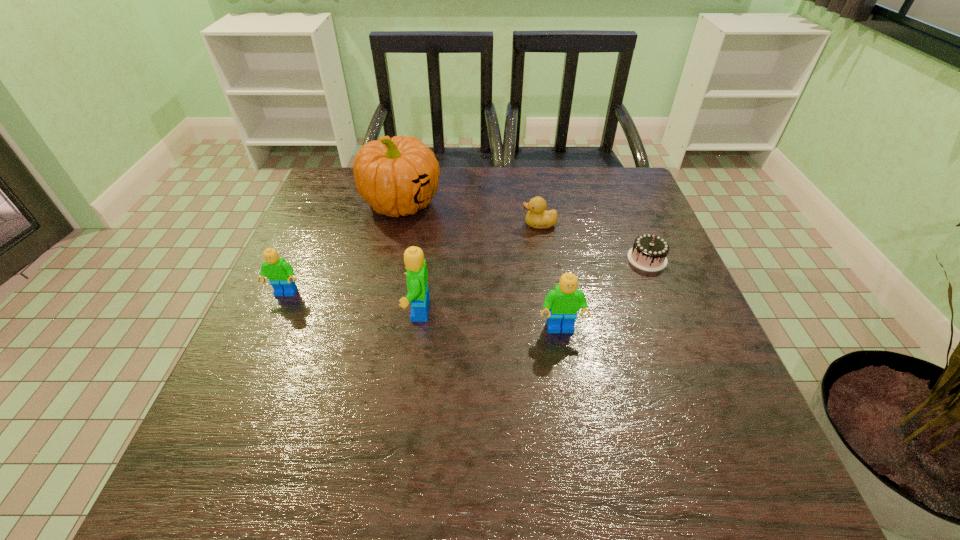
The width and height of the screenshot is (960, 540). Find the location of `Lego at the left edge`. Lego at the left edge is located at coordinates (280, 273).

You are a GUI agent. You are given a task and a screenshot of the screen. Output one action in this format:
    pyautogui.click(x=<x>, y=<y>)
    Task: Click on the pumpkin at the left edge
    
    Given the screenshot: What is the action you would take?
    pyautogui.click(x=396, y=176)

Where is `object that is at the right edge`? This screenshot has width=960, height=540. object that is at the right edge is located at coordinates pos(649,252).

The height and width of the screenshot is (540, 960). I want to click on object that is at the far left corner, so click(396, 176).

Where is `free space at the far edge of the desktop`? This screenshot has width=960, height=540. free space at the far edge of the desktop is located at coordinates (542, 196).

In the image, there is a desktop. Identify the location of vacant area at the near edge. The width and height of the screenshot is (960, 540). (628, 422).

Where is `blank space at the left edge of the desktop`? blank space at the left edge of the desktop is located at coordinates (348, 260).

Where is `free region at the right edge of the desktop`? The width and height of the screenshot is (960, 540). free region at the right edge of the desktop is located at coordinates (604, 235).

In the image, there is a desktop. Identify the location of free space at the far left corner. The image size is (960, 540). point(343,208).

This screenshot has width=960, height=540. Find the location of `free spot at the near left corner of the desktop`. free spot at the near left corner of the desktop is located at coordinates (296, 401).